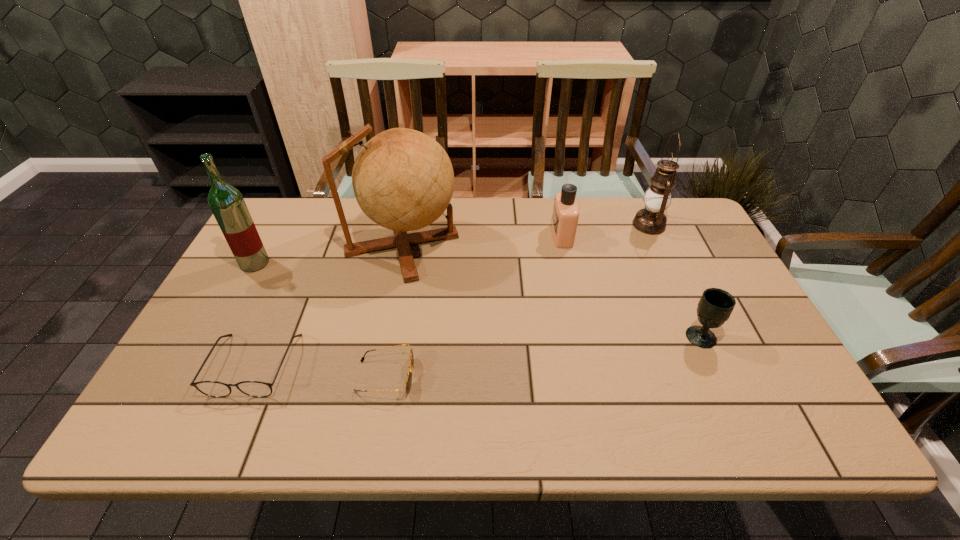
Locate an element on the screen. The height and width of the screenshot is (540, 960). liquor located in the left edge section of the desktop is located at coordinates (226, 202).

The height and width of the screenshot is (540, 960). I want to click on spectacles that is at the left edge, so click(x=217, y=389).

Find the location of a particular element. oil lamp located at the right edge is located at coordinates (651, 220).

At what (x,y) coordinates should I click in order to perform the action: click on chalice that is at the right edge. Please return your answer as a coordinate pair (x, y). Looking at the image, I should click on (714, 308).

This screenshot has width=960, height=540. In order to click on object present at the far right corner in this screenshot , I will do `click(651, 220)`.

Image resolution: width=960 pixels, height=540 pixels. I want to click on free space at the far edge of the desktop, so click(632, 217).

In the image, there is a desktop. At what (x,y) coordinates should I click in order to perform the action: click on vacant space at the near edge. Please return your answer as a coordinate pair (x, y). The image size is (960, 540). Looking at the image, I should click on (677, 417).

This screenshot has width=960, height=540. Identify the location of vacant space at the left edge of the desktop. (228, 370).

Where is `free space at the right edge of the desktop`? The image size is (960, 540). free space at the right edge of the desktop is located at coordinates (740, 315).

Image resolution: width=960 pixels, height=540 pixels. I want to click on vacant point at the far left corner, so click(x=282, y=212).